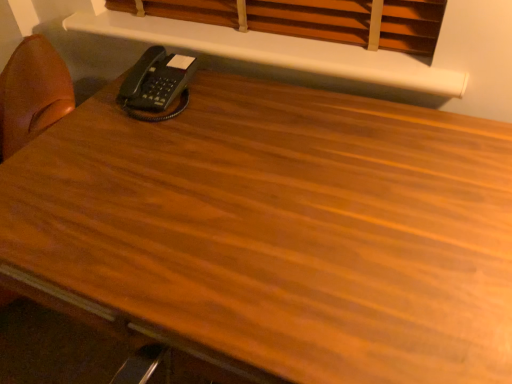
The width and height of the screenshot is (512, 384). I want to click on free point above white matte shelf at upper center (from a real-world perspective), so click(x=193, y=23).